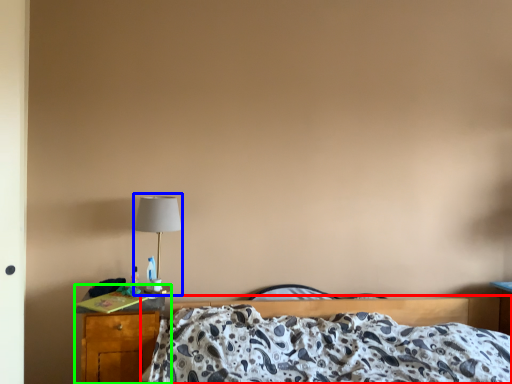
Question: Which object is positioned farthest from bed (highlighted by a red box)? Select from table lamp (highlighted by a blue box) and nightstand (highlighted by a green box).

Choices:
 (A) table lamp
 (B) nightstand

Answer: (A)